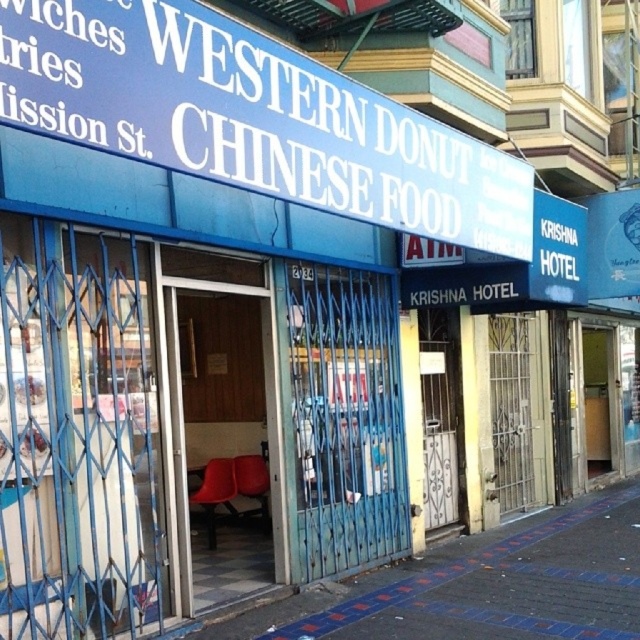
You are a delivery person standing outside the closed storefront on Mission Street. You need to place a package on the blue tiled pavement at lower center. However, there is a blue painted signboard at upper center in the way. Can you place the package there without moving the signboard?

The blue painted signboard at upper center is above the blue tiled pavement at lower center, so it does not block access to the pavement. The package can be placed there without moving the signboard.

You are standing at the entrance of the Mission Street storefront. There is a point marked at coordinates (483, 586). According to the image, where is this point located?

The point is located on the blue tiled pavement at lower center.